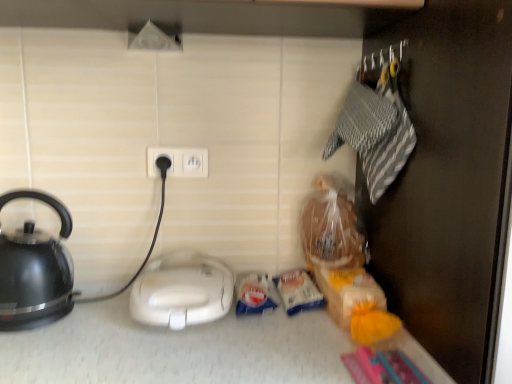
Question: Is black glossy kettle at left with white plastic sandwich maker at center?

Choices:
 (A) yes
 (B) no

Answer: (B)

Question: Is black glossy kettle at left to the right of white plastic sandwich maker at center from the viewer's perspective?

Choices:
 (A) yes
 (B) no

Answer: (B)

Question: Does black glossy kettle at left have a greater height compared to white plastic sandwich maker at center?

Choices:
 (A) no
 (B) yes

Answer: (B)

Question: Can you confirm if black glossy kettle at left is thinner than white plastic sandwich maker at center?

Choices:
 (A) no
 (B) yes

Answer: (B)

Question: Is black glossy kettle at left further to the viewer compared to white plastic sandwich maker at center?

Choices:
 (A) yes
 (B) no

Answer: (B)

Question: Based on their sizes in the image, would you say white plastic socket at center is bigger or smaller than white plastic sandwich maker at center?

Choices:
 (A) small
 (B) big

Answer: (A)

Question: Considering the positions of white plastic socket at center and white plastic sandwich maker at center in the image, is white plastic socket at center taller or shorter than white plastic sandwich maker at center?

Choices:
 (A) tall
 (B) short

Answer: (B)

Question: From a real-world perspective, is white plastic socket at center physically located above or below white plastic sandwich maker at center?

Choices:
 (A) above
 (B) below

Answer: (A)

Question: From the image's perspective, is white plastic socket at center located above or below white plastic sandwich maker at center?

Choices:
 (A) below
 (B) above

Answer: (B)

Question: In terms of height, does white plastic sandwich maker at center look taller or shorter compared to black glossy kettle at left?

Choices:
 (A) tall
 (B) short

Answer: (B)

Question: Is white plastic sandwich maker at center wider or thinner than black glossy kettle at left?

Choices:
 (A) thin
 (B) wide

Answer: (B)

Question: From the image's perspective, is white plastic sandwich maker at center located above or below black glossy kettle at left?

Choices:
 (A) below
 (B) above

Answer: (A)

Question: From a real-world perspective, is white plastic sandwich maker at center above or below black glossy kettle at left?

Choices:
 (A) below
 (B) above

Answer: (A)

Question: In terms of size, does black glossy kettle at left appear bigger or smaller than white plastic socket at center?

Choices:
 (A) small
 (B) big

Answer: (B)

Question: Considering the positions of black glossy kettle at left and white plastic socket at center in the image, is black glossy kettle at left wider or thinner than white plastic socket at center?

Choices:
 (A) wide
 (B) thin

Answer: (A)